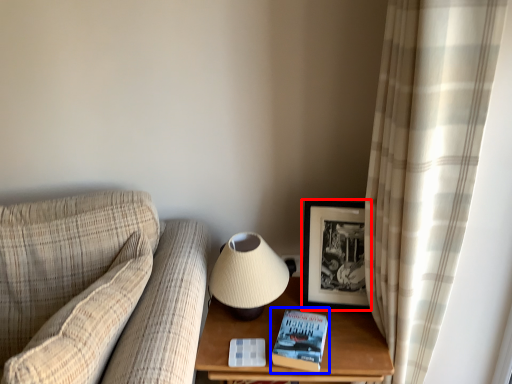
Question: Which of the following is the farthest to the observer, picture frame (highlighted by a red box) or paperback book (highlighted by a blue box)?

Choices:
 (A) picture frame
 (B) paperback book

Answer: (A)